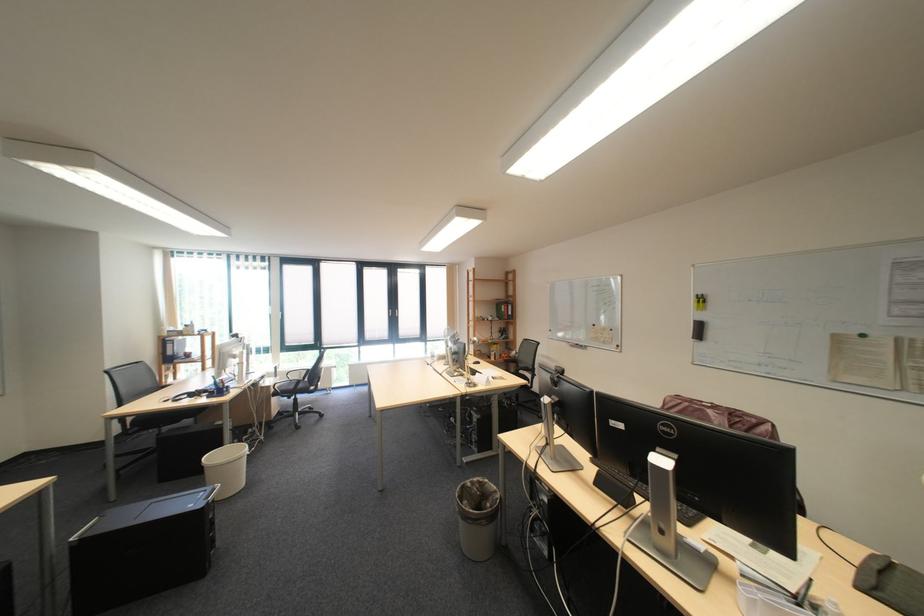
The height and width of the screenshot is (616, 924). Identify the location of maroon bag handle. (711, 411).